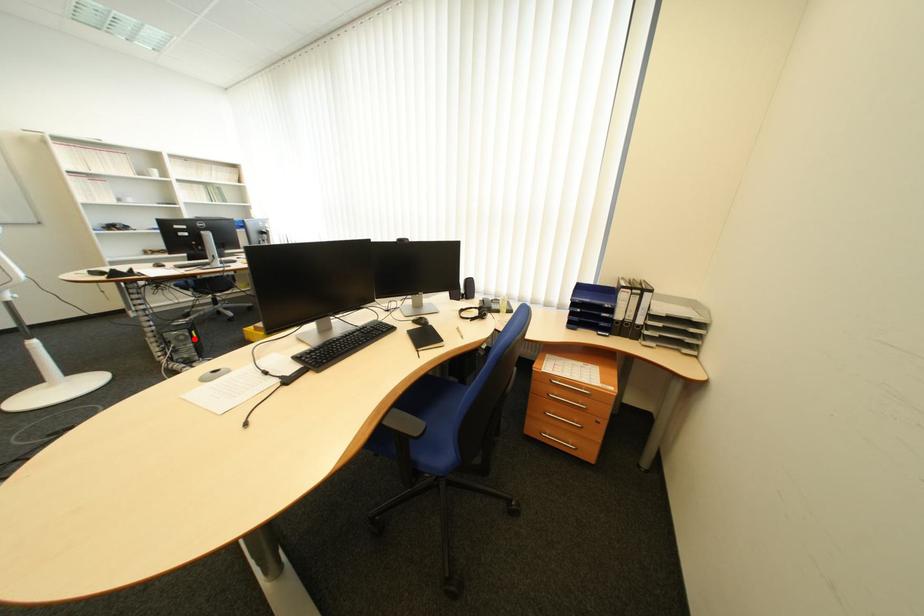
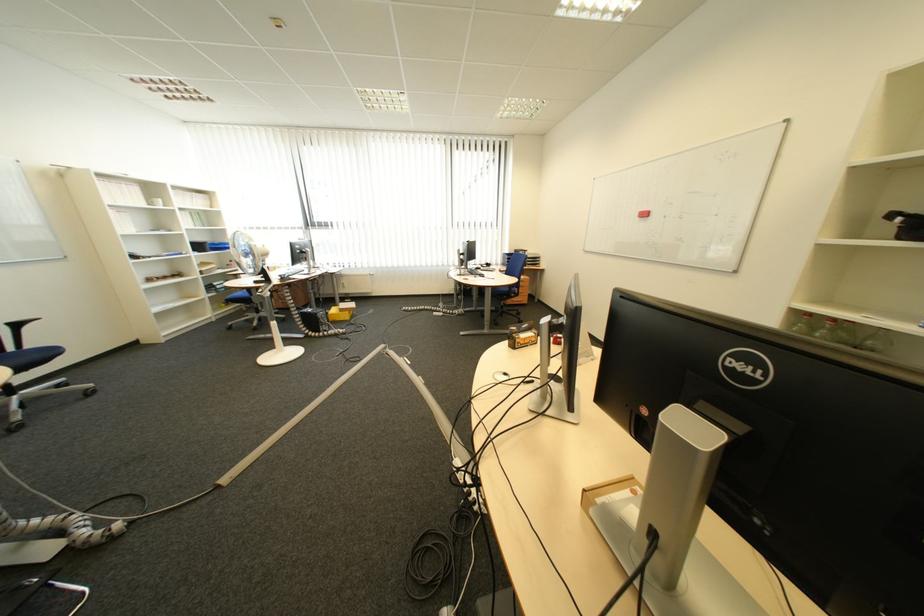
Find the pixel in the second image that matches the highlighted location in the first image.

(335, 317)